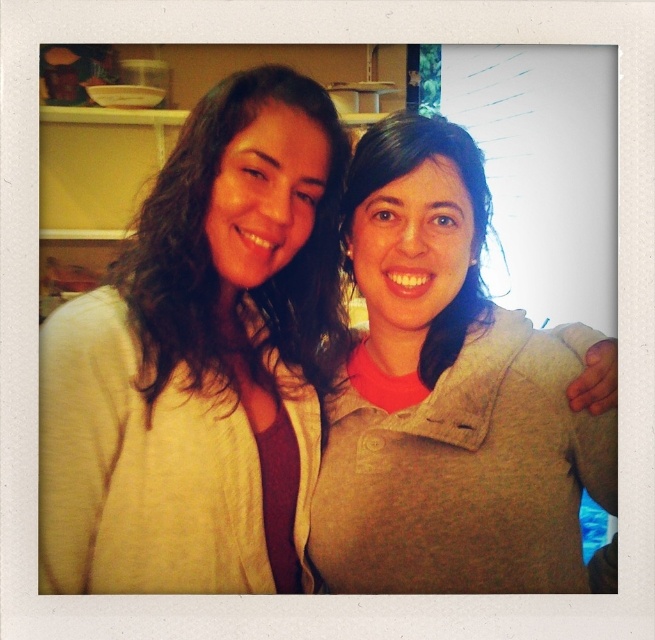
Which is above, matte white cardigan at left or matte gray sweater at center?

matte white cardigan at left

Is point (128, 340) less distant than point (375, 352)?

Yes, point (128, 340) is in front of point (375, 352).

You are a GUI agent. You are given a task and a screenshot of the screen. Output one action in this format:
    pyautogui.click(x=<x>, y=<y>)
    Task: Click on the matte white cardigan at left
    The height and width of the screenshot is (640, 655).
    Given the screenshot: What is the action you would take?
    pyautogui.click(x=200, y=360)